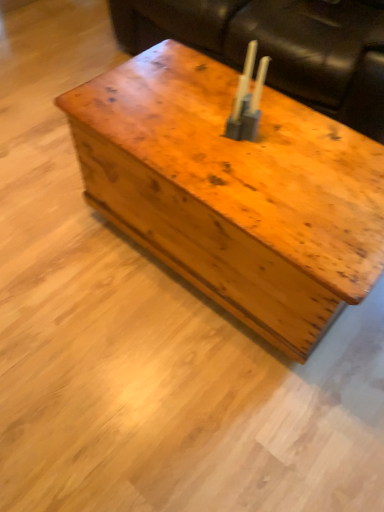
Find the location of `vacant space behind metallic silver candle holder at center`. vacant space behind metallic silver candle holder at center is located at coordinates (221, 97).